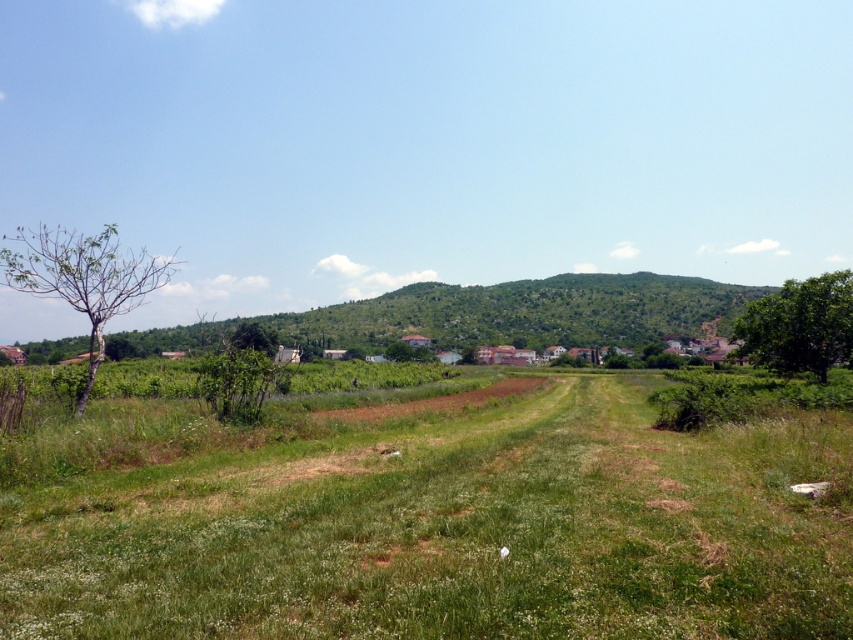
Can you confirm if bare wood tree at left is wider than green leafy tree at right?

Yes, bare wood tree at left is wider than green leafy tree at right.

Is point (82, 285) farther from viewer compared to point (759, 364)?

No, it is in front of (759, 364).

Locate an element on the screen. This screenshot has width=853, height=640. bare wood tree at left is located at coordinates (83, 278).

Can you confirm if green grassy field at center is positioned to the right of green leafy tree at right?

No, green grassy field at center is not to the right of green leafy tree at right.

From the picture: Who is shorter, green grassy field at center or green leafy tree at right?

green grassy field at center is shorter.

I want to click on green grassy field at center, so click(451, 531).

Can you confirm if green grassy field at center is thinner than bare wood tree at left?

Correct, green grassy field at center's width is less than bare wood tree at left's.

In order to click on green grassy field at center in this screenshot , I will do 451,531.